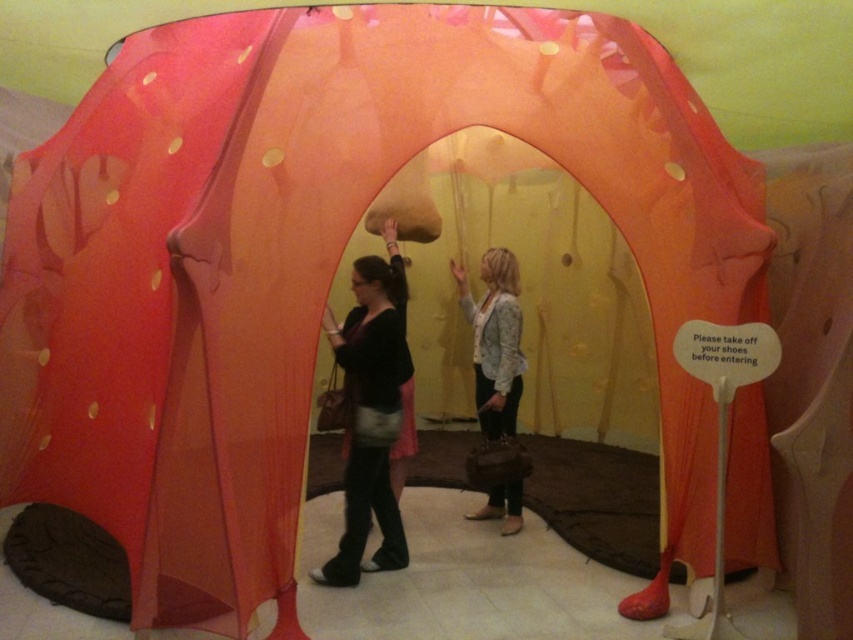
Does point (370, 449) come farther from viewer compared to point (476, 515)?

No, it is not.

Is matte black sweater at center in front of light blue textured jacket at center?

Yes, it is.

Is point (401, 291) more distant than point (485, 387)?

No, it is in front of (485, 387).

Find the location of a particular element. matte black sweater at center is located at coordinates (370, 412).